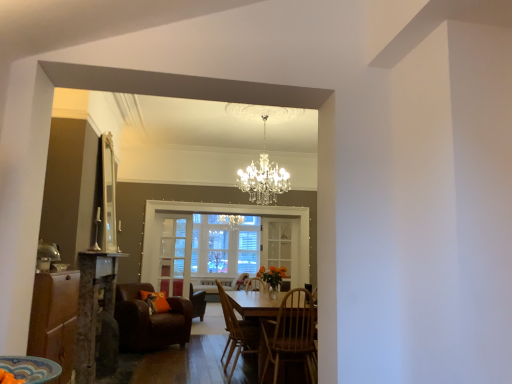
Question: Do you think wooden chair at center, which is the fourth chair from back to front, is within wooden cabinet at lower left, or outside of it?

Choices:
 (A) outside
 (B) inside

Answer: (A)

Question: Visually, is wooden chair at center, which is the fourth chair from back to front, positioned to the left or to the right of wooden cabinet at lower left?

Choices:
 (A) right
 (B) left

Answer: (A)

Question: Which of these objects is positioned closest to the clear glass door at center, the 1th glass door when ordered from left to right?

Choices:
 (A) wooden chair at center, the 3th chair from the back
 (B) clear glass door at center, which appears as the first glass door when viewed from the right
 (C) brown leather chair at center, the first chair positioned from the back
 (D) clear glass window at center
 (E) wooden chair at center, which is the fourth chair from back to front

Answer: (D)

Question: Based on their relative distances, which object is nearer to the leather armchair at lower left, the 3th chair when ordered from front to back?

Choices:
 (A) clear glass window at center
 (B) wooden cabinet at lower left
 (C) clear glass door at center, placed as the 2th glass door when sorted from left to right
 (D) wooden chair at center, which is the second chair from front to back
 (E) wooden chair at center, which ranks as the first chair in front-to-back order

Answer: (A)